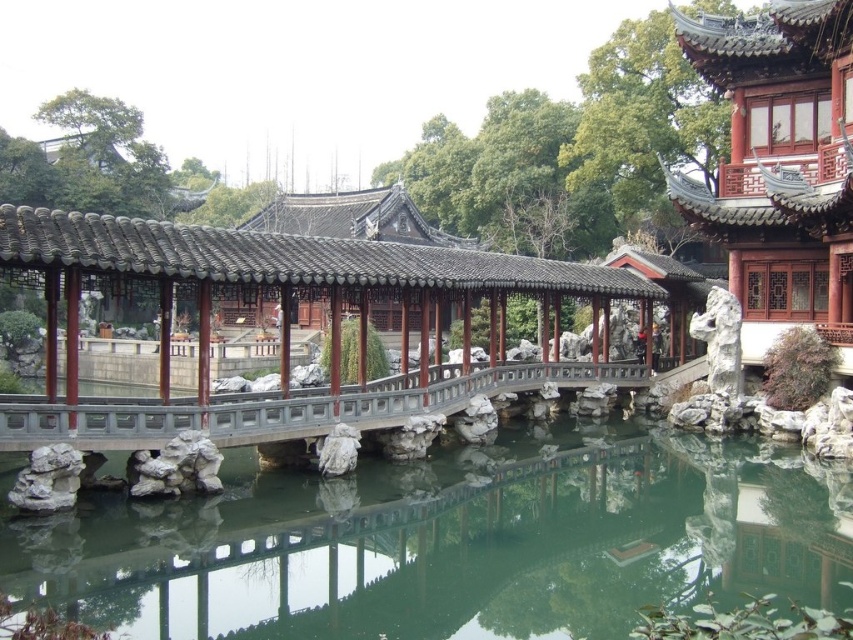
Question: Is clear glass water at center positioned behind wooden bridge at center?

Choices:
 (A) yes
 (B) no

Answer: (B)

Question: Which point appears farthest from the camera in this image?

Choices:
 (A) (x=198, y=413)
 (B) (x=402, y=598)

Answer: (A)

Question: Is clear glass water at center above wooden bridge at center?

Choices:
 (A) yes
 (B) no

Answer: (B)

Question: Which point is farther from the camera taking this photo?

Choices:
 (A) (485, 582)
 (B) (97, 429)
 (C) (181, 225)

Answer: (C)

Question: Based on their relative distances, which object is farther from the smooth gray stone bridge at center?

Choices:
 (A) wooden bridge at center
 (B) clear glass water at center

Answer: (B)

Question: From the image, what is the correct spatial relationship of wooden bridge at center in relation to smooth gray stone bridge at center?

Choices:
 (A) below
 (B) above

Answer: (B)